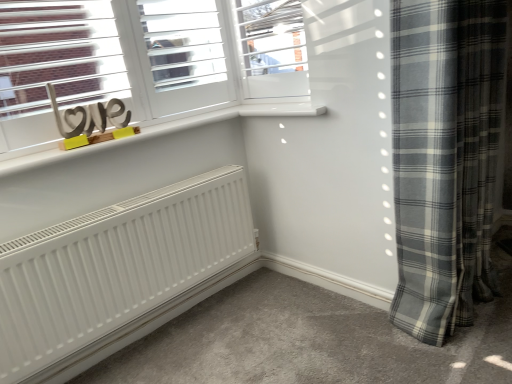
Question: From the image's perspective, relative to gray plaid curtain at right, is white frosted glass window at upper center above or below?

Choices:
 (A) below
 (B) above

Answer: (B)

Question: Based on their positions, is white frosted glass window at upper center located to the left or right of gray plaid curtain at right?

Choices:
 (A) left
 (B) right

Answer: (A)

Question: Estimate the real-world distances between objects in this image. Which object is closer to the gray plaid curtain at right?

Choices:
 (A) wooden love sign at upper left
 (B) white frosted glass window at upper center

Answer: (B)

Question: Estimate the real-world distances between objects in this image. Which object is closer to the gray plaid curtain at right?

Choices:
 (A) white frosted glass window at upper center
 (B) wooden love sign at upper left

Answer: (A)